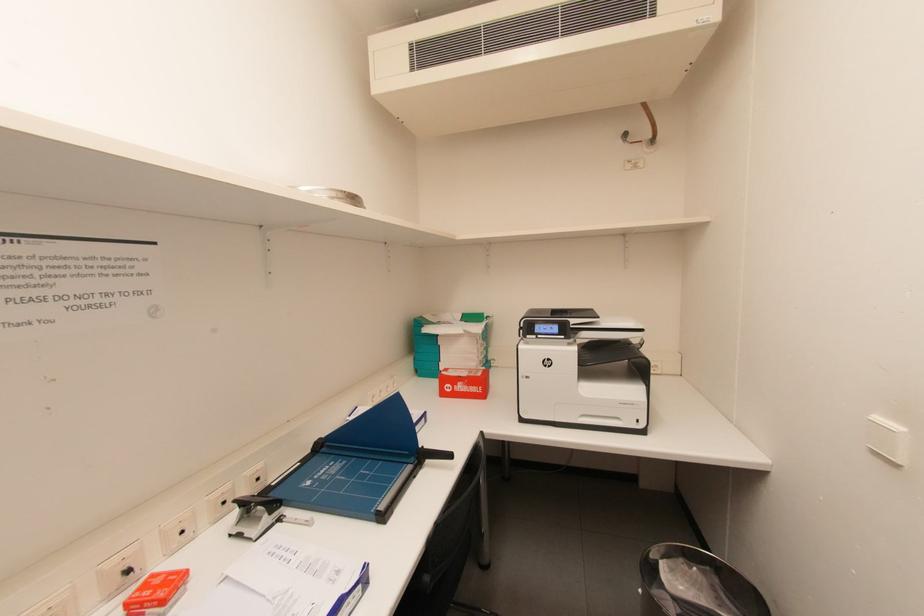
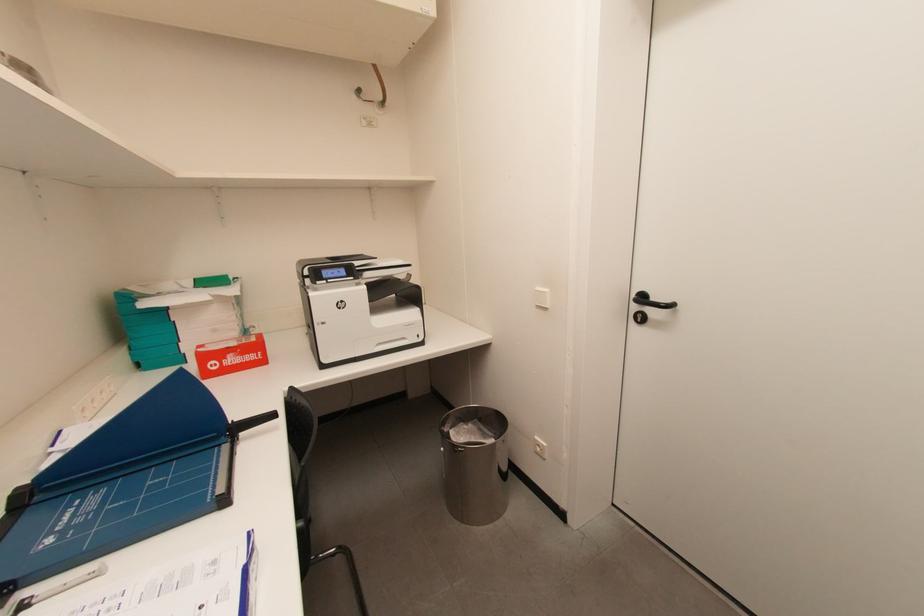
Question: The camera is either moving clockwise (left) or counter-clockwise (right) around the object. The first image is from the beginning of the video and the second image is from the end. Is the camera moving left or right when shooting the video?

Choices:
 (A) Left
 (B) Right

Answer: (A)